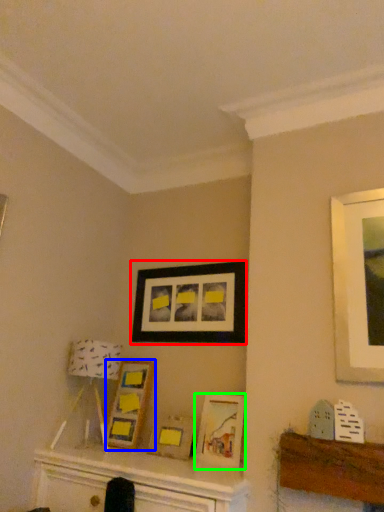
Question: Based on their relative distances, which object is nearer to picture frame (highlighted by a red box)? Choose from picture frame (highlighted by a blue box) and picture frame (highlighted by a green box).

Choices:
 (A) picture frame
 (B) picture frame

Answer: (A)